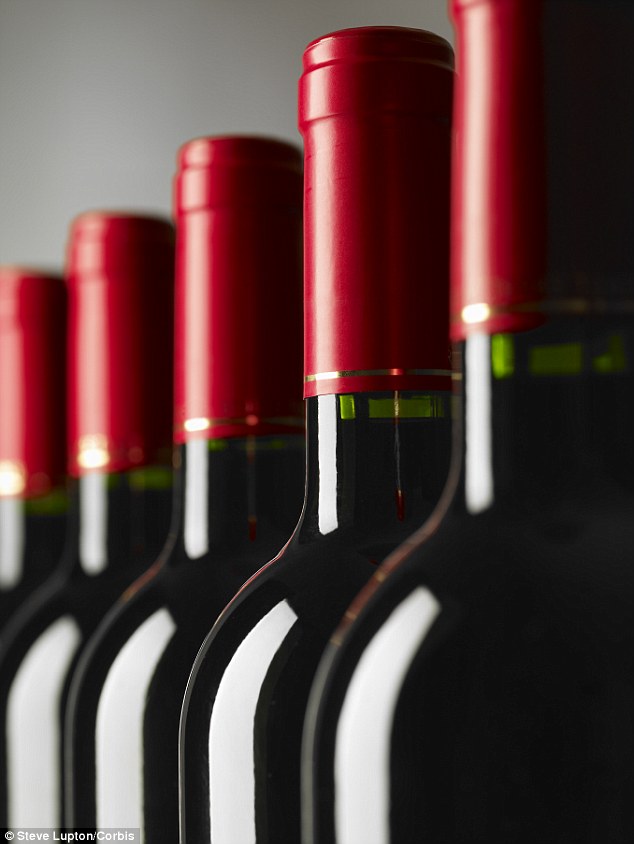
Identify the location of wine bottles. (32, 538), (101, 555), (163, 555), (309, 560), (441, 598).